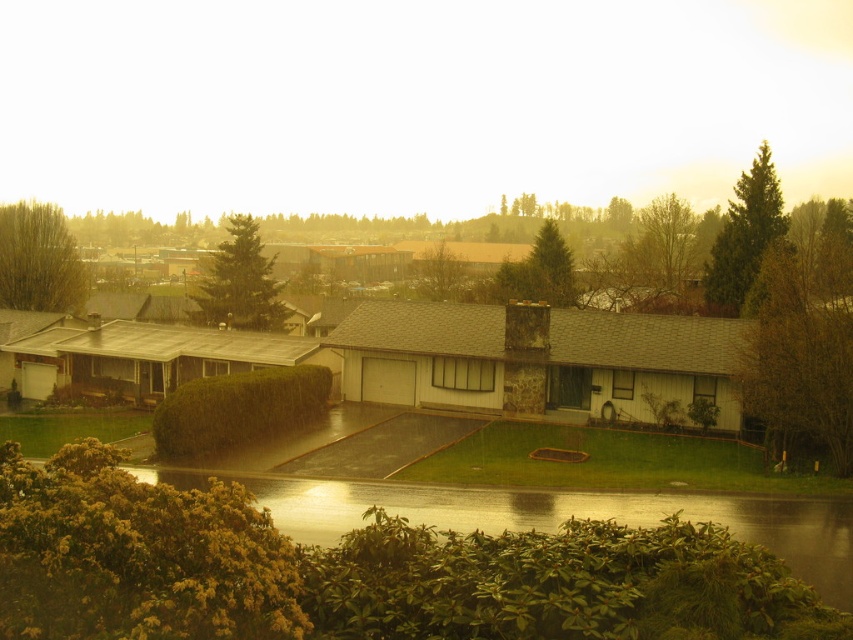
You are standing in the middle of the suburban residential area and want to take a photo of the green leafy tree at right and the green matte tree at center. Which tree will appear larger in your photo?

The green leafy tree at right will appear larger in your photo because it is closer to you than the green matte tree at center.

You are standing in the middle of the suburban residential area and want to take a photo of both the green textured tree at upper right and the green leafy tree at center. Which tree should you position yourself closer to in order to capture both in the same frame?

To capture both the green textured tree at upper right and the green leafy tree at center in the same frame, you should position yourself closer to the green leafy tree at center since the green textured tree at upper right is to the right of it, allowing both to be included in the camera view.

You are standing in the middle of the suburban residential area and want to walk towards the green leafy tree at right. Which direction should you go to avoid the green matte tree at center?

To avoid the green matte tree at center, you should walk towards the right side since the green leafy tree at right is narrower and positioned further to the east compared to the wider green matte tree at center.